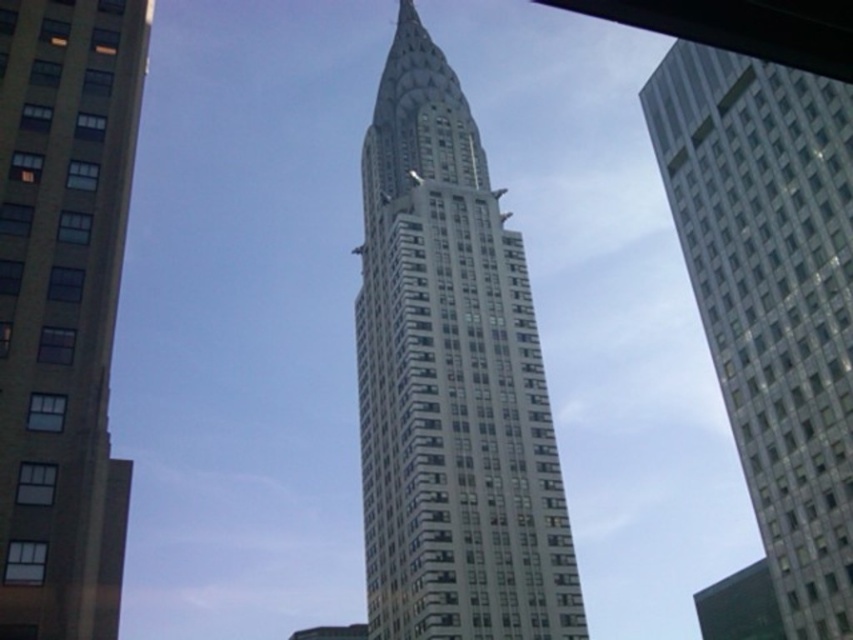
Question: Which object is the closest to the white glass building at center?

Choices:
 (A) smooth concrete building at center
 (B) glassy white skyscraper at right

Answer: (B)

Question: Does white glass building at center come behind glassy white skyscraper at right?

Choices:
 (A) yes
 (B) no

Answer: (A)

Question: Which point is closer to the camera?

Choices:
 (A) glassy white skyscraper at right
 (B) white glass building at center
 (C) smooth concrete building at center

Answer: (C)

Question: Based on their relative distances, which object is nearer to the white glass building at center?

Choices:
 (A) glassy white skyscraper at right
 (B) smooth concrete building at center

Answer: (A)

Question: Does white glass building at center have a lesser width compared to smooth concrete building at center?

Choices:
 (A) yes
 (B) no

Answer: (B)

Question: From the image, what is the correct spatial relationship of glassy white skyscraper at right in relation to smooth concrete building at center?

Choices:
 (A) above
 (B) below

Answer: (A)